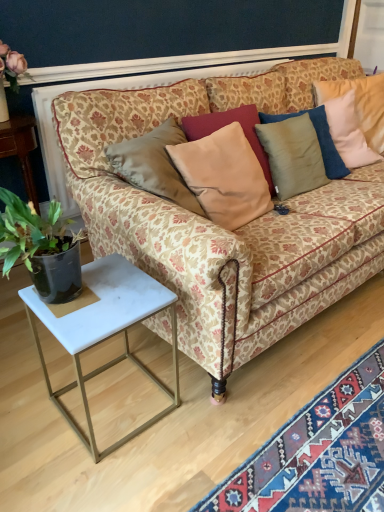
Find the location of a particular element. The height and width of the screenshot is (512, 384). vacant space underneath white marble side table at lower left (from a real-world perspective) is located at coordinates (117, 401).